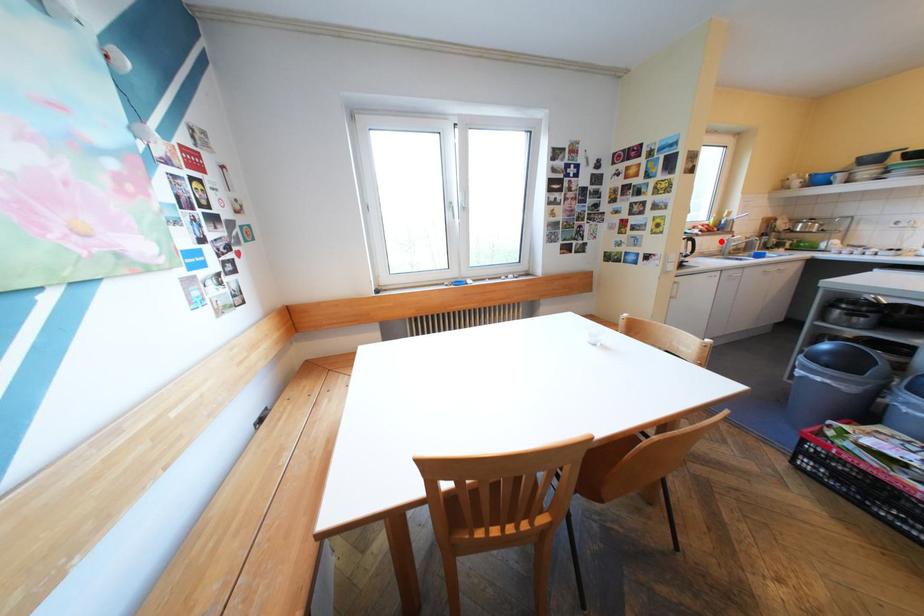
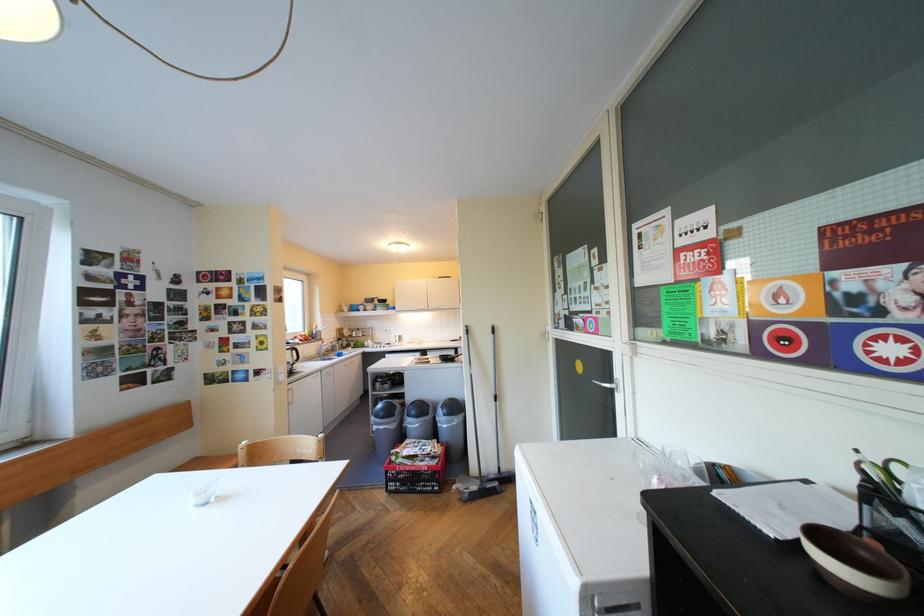
In the second image, find the point that corresponds to the highlighted location in the first image.

(321, 349)